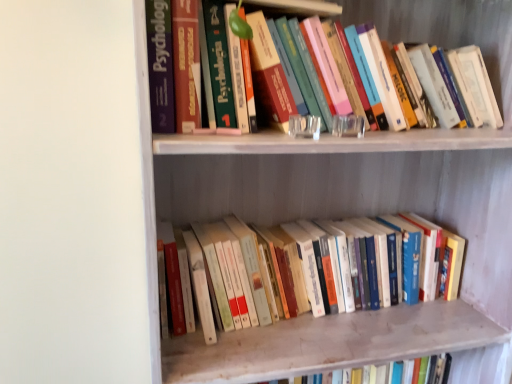
Question: Considering the relative positions of hardcover books at lower center, arranged as the 1th book when ordered from the bottom, and hardcover book at upper center, which ranks as the 1th book in top-to-bottom order, in the image provided, is hardcover books at lower center, arranged as the 1th book when ordered from the bottom, to the left or to the right of hardcover book at upper center, which ranks as the 1th book in top-to-bottom order,?

Choices:
 (A) right
 (B) left

Answer: (B)

Question: From their relative heights in the image, would you say hardcover books at lower center, arranged as the 1th book when ordered from the bottom, is taller or shorter than hardcover book at upper center, the 2th book from the bottom?

Choices:
 (A) short
 (B) tall

Answer: (A)

Question: Which object is the farthest from the hardcover book at upper center, the 2th book from the bottom?

Choices:
 (A) hardcover books at lower center, which is the second book from top to bottom
 (B) wooden bookshelf at upper center

Answer: (A)

Question: Which is farther from the wooden bookshelf at upper center?

Choices:
 (A) hardcover books at lower center, which is the second book from top to bottom
 (B) hardcover book at upper center, which ranks as the 1th book in top-to-bottom order

Answer: (B)